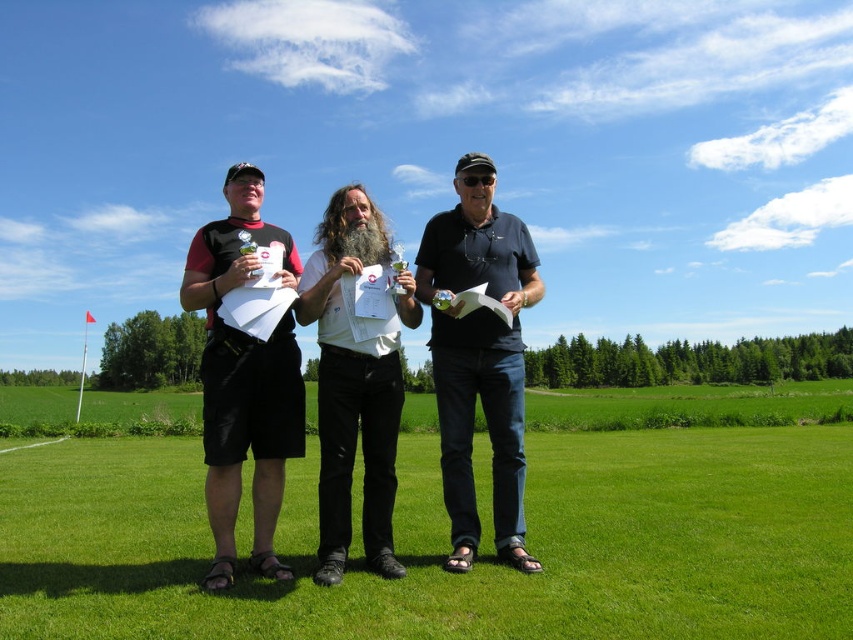
You are standing at the point marked by the coordinates point (482, 534). What is the color of the ground beneath your feet?

The point (482, 534) is on green grass at center, so the ground beneath your feet is green.